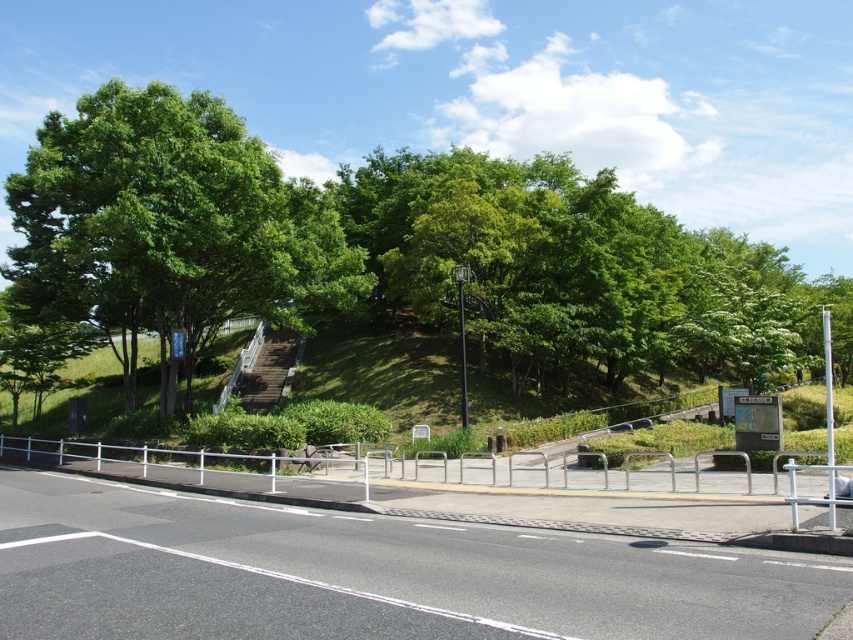
Based on the photo, is green leafy tree at upper center thinner than black metal pole at center?

No.

In the scene shown: Is green leafy tree at upper center bigger than black metal pole at center?

Yes.

You are a GUI agent. You are given a task and a screenshot of the screen. Output one action in this format:
    pyautogui.click(x=<x>, y=<y>)
    Task: Click on the green leafy tree at upper center
    
    Given the screenshot: What is the action you would take?
    pyautogui.click(x=386, y=250)